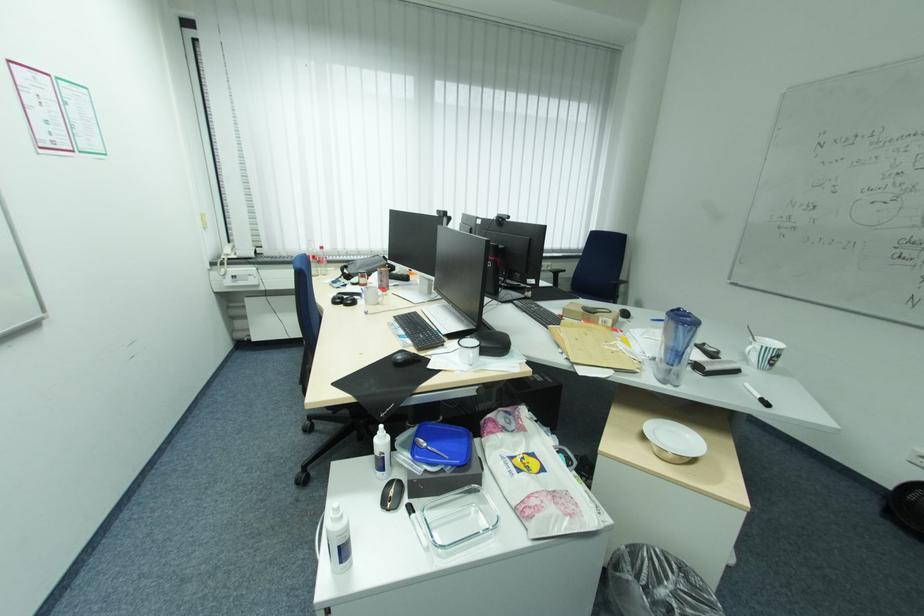
Identify the location of white bowl. This screenshot has height=616, width=924. (673, 440).